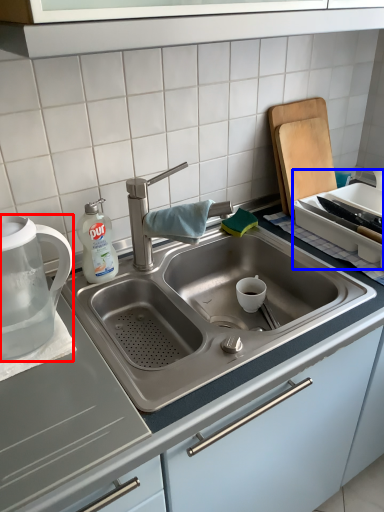
Question: Which object appears farthest to the camera in this image, tea pot (highlighted by a red box) or appliance (highlighted by a blue box)?

Choices:
 (A) tea pot
 (B) appliance

Answer: (B)